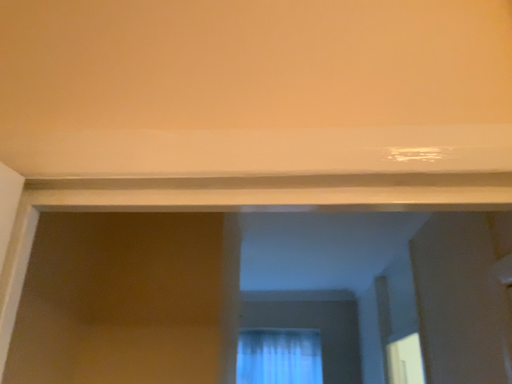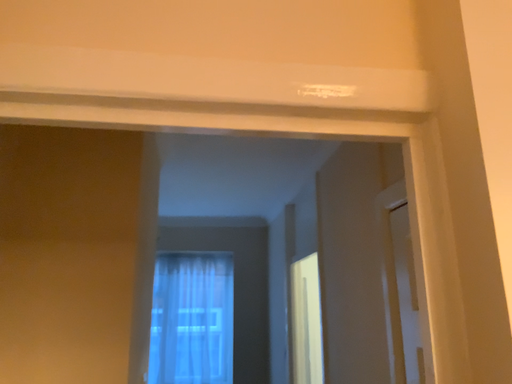
Question: How did the camera likely rotate when shooting the video?

Choices:
 (A) rotated upward
 (B) rotated downward

Answer: (B)